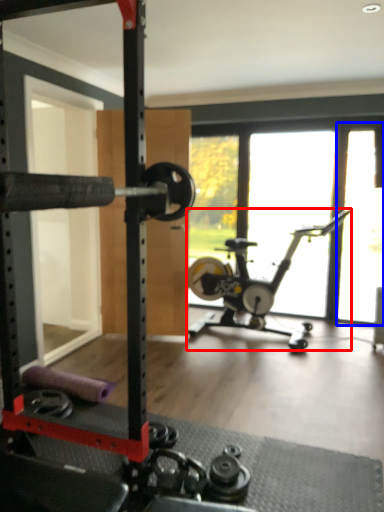
Question: Which object is further to the camera taking this photo, stationary bicycle (highlighted by a red box) or window screen (highlighted by a blue box)?

Choices:
 (A) stationary bicycle
 (B) window screen

Answer: (B)